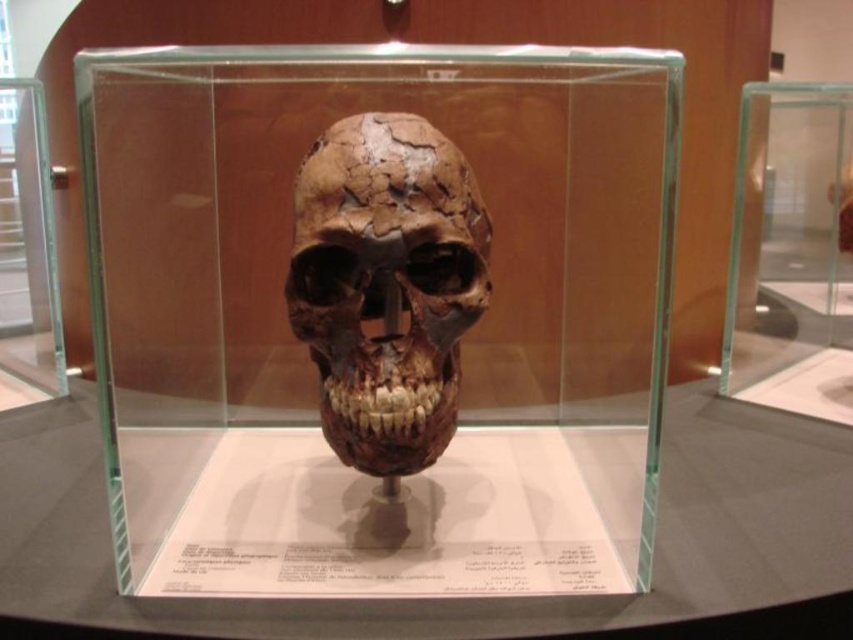
You are a museum security guard who needs to inspect the transparent glass skull at center and the transparent glass table at center. Which object is positioned higher from the floor?

The transparent glass skull at center is above the transparent glass table at center, so the transparent glass skull at center is higher from the floor.

You are a museum curator preparing to move the brown cracked bone skull at center into a new display case. The new case has a maximum width of 1 meter. If the transparent glass table at center currently holds the skull and its width is larger than the skull, can the skull fit in the new case?

The transparent glass table at center is wider than the brown cracked bone skull at center. Since the table is larger, the skull might still fit in the new case with a 1 meter width, but we need to know the exact dimensions of the skull to confirm.